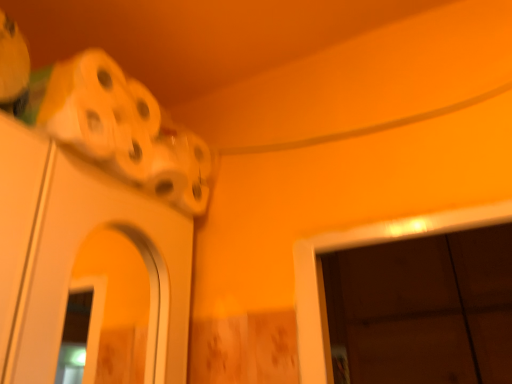
Locate an element on the screen. The image size is (512, 384). white matte plastic toy at upper left is located at coordinates (106, 120).

The height and width of the screenshot is (384, 512). Describe the element at coordinates (106, 120) in the screenshot. I see `white matte plastic toy at upper left` at that location.

At what (x,y) coordinates should I click in order to perform the action: click on white matte plastic toy at upper left. Please return your answer as a coordinate pair (x, y). The width and height of the screenshot is (512, 384). Looking at the image, I should click on (106, 120).